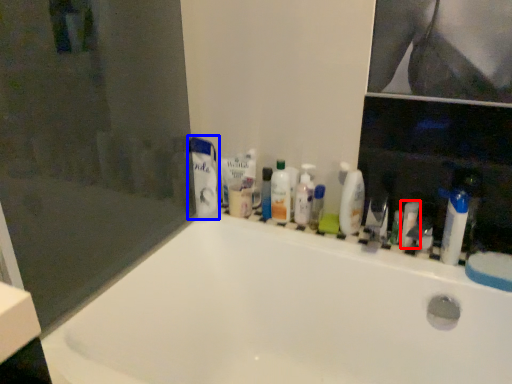
Question: Among these objects, which one is nearest to the camera, toiletry (highlighted by a red box) or toothpaste (highlighted by a blue box)?

Choices:
 (A) toiletry
 (B) toothpaste

Answer: (A)